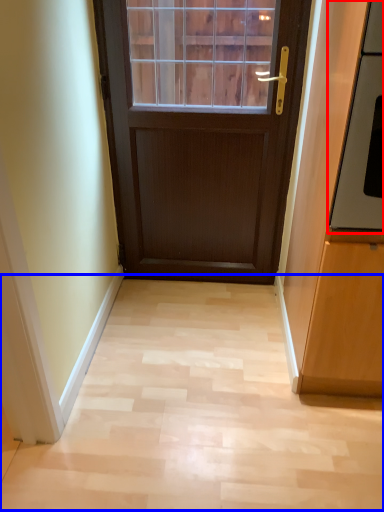
Question: Which object appears farthest to the camera in this image, oven (highlighted by a red box) or corridor (highlighted by a blue box)?

Choices:
 (A) oven
 (B) corridor

Answer: (B)